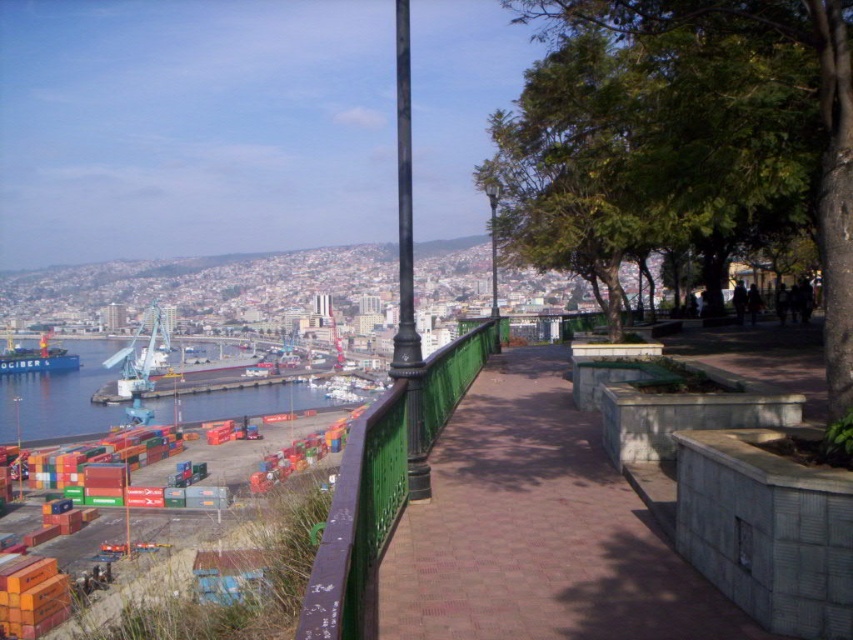
The height and width of the screenshot is (640, 853). Identify the location of green wrought iron railing at center. (358, 518).

Between green wrought iron railing at center and green wrought iron pole at center, which one appears on the right side from the viewer's perspective?

green wrought iron railing at center is more to the right.

The image size is (853, 640). I want to click on green wrought iron railing at center, so click(358, 518).

Find the location of a particular element. The width and height of the screenshot is (853, 640). green wrought iron railing at center is located at coordinates (358, 518).

Can you confirm if green wrought iron pole at center is taller than metallic pole at center?

Indeed, green wrought iron pole at center has a greater height compared to metallic pole at center.

Who is more distant from viewer, (405,90) or (492,237)?

Positioned behind is point (492,237).

Where is `green wrought iron pole at center`? green wrought iron pole at center is located at coordinates point(407,273).

Which is in front, point (405, 502) or point (495, 232)?

Point (405, 502) is more forward.

The height and width of the screenshot is (640, 853). In order to click on green wrought iron railing at center in this screenshot , I will do click(358, 518).

Locate an element on the screen. green wrought iron railing at center is located at coordinates (358, 518).

The image size is (853, 640). I want to click on green wrought iron railing at center, so click(x=358, y=518).